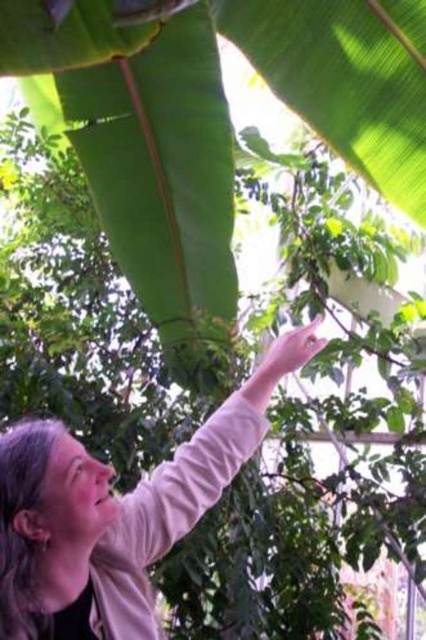
Can you confirm if light pink fabric at upper right is bigger than pink smooth skin at upper center?

Correct, light pink fabric at upper right is larger in size than pink smooth skin at upper center.

Is light pink fabric at upper right further to camera compared to pink smooth skin at upper center?

No.

Which is in front, point (25, 444) or point (296, 332)?

Point (25, 444) is more forward.

Identify the location of light pink fabric at upper right. Image resolution: width=426 pixels, height=640 pixels. (104, 520).